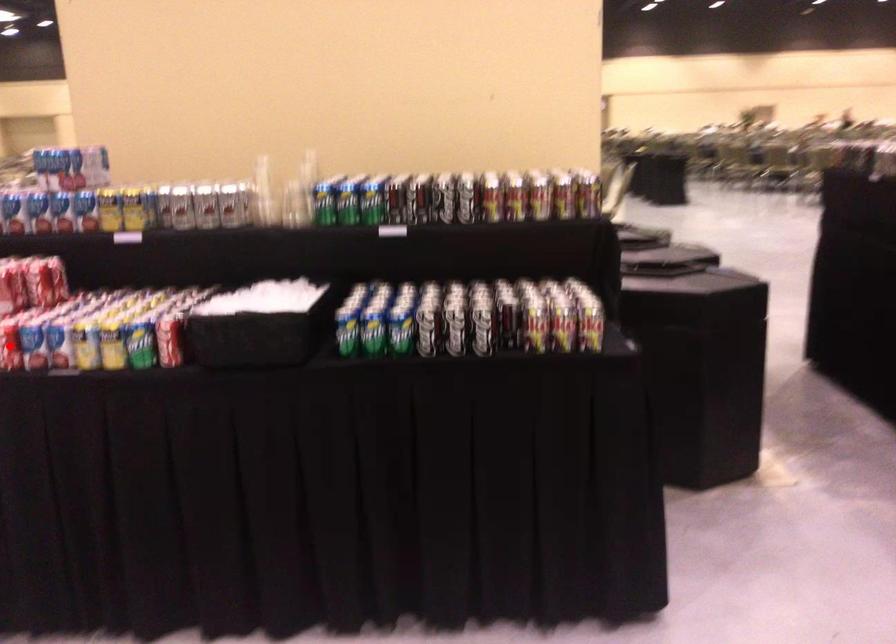
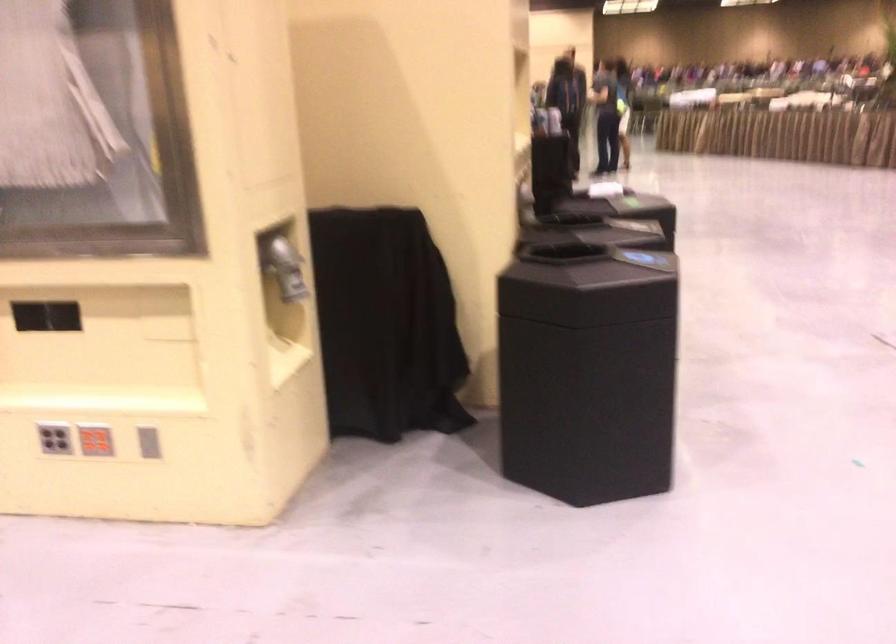
Question: I am providing you with two images of the same scene from different viewpoints. A red point is marked on the first image. Is the red point's position out of view in image 2?

Choices:
 (A) Yes
 (B) No

Answer: (A)